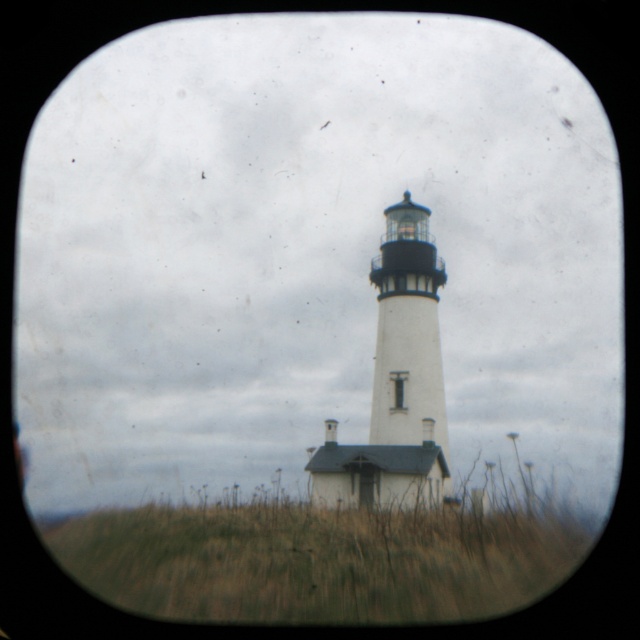
You are a drone operator trying to capture a photo of the lighthouse. The drone is currently hovering at point coordinates of 0.5, 0.5. You need to adjust the drone to avoid the brown dry grass at lower center. Which direction should you move the drone to avoid it?

The brown dry grass at lower center is located at point (321, 557). Since the drone is at (320, 320), moving it to the left would decrease the x coordinate, so moving left would move the drone away from the grass. Alternatively, moving slightly upward would increase the y coordinate, but since the grass is at 0.503 in y, moving up to 0.51 would also avoid it. However, the primary direction to move away from the grass at (321, 557) from (320, 320) is to the left.